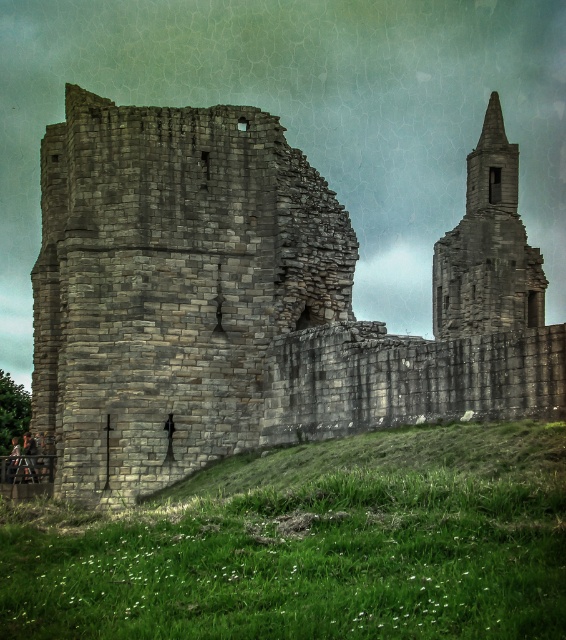
Question: Is gray stone castle at left to the left of green grassy at lower center from the viewer's perspective?

Choices:
 (A) yes
 (B) no

Answer: (B)

Question: Is gray stone castle at left wider than green grassy at lower center?

Choices:
 (A) no
 (B) yes

Answer: (B)

Question: Which of the following is the closest to the observer?

Choices:
 (A) gray stone tower at upper right
 (B) green grassy at lower center

Answer: (B)

Question: Which object is positioned farthest from the gray stone castle at left?

Choices:
 (A) gray stone tower at upper right
 (B) green grassy at lower center

Answer: (B)

Question: Is green grassy at lower center above gray stone tower at upper right?

Choices:
 (A) no
 (B) yes

Answer: (A)

Question: Which object is closer to the camera taking this photo?

Choices:
 (A) gray stone tower at upper right
 (B) green grassy at lower center

Answer: (B)